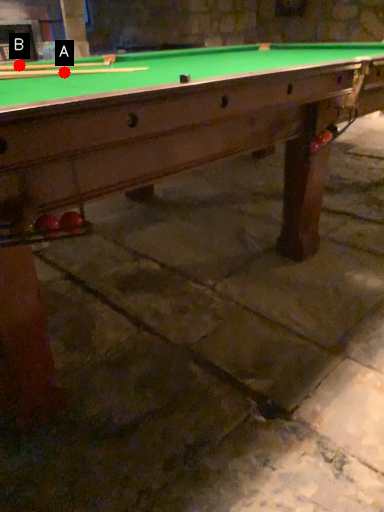
Question: Two points are circled on the image, labeled by A and B beside each circle. Among these points, which one is nearest to the camera?

Choices:
 (A) A is closer
 (B) B is closer

Answer: (A)